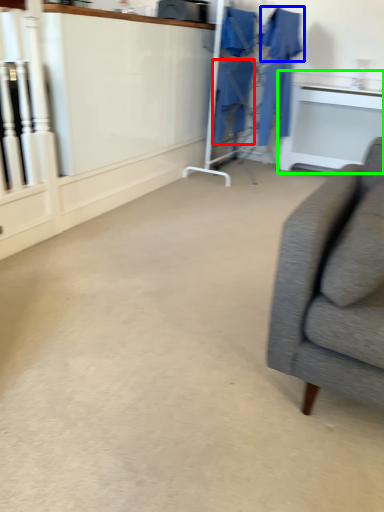
Question: Which is farther away from robe (highlighted by a red box)? robe (highlighted by a blue box) or table (highlighted by a green box)?

Choices:
 (A) robe
 (B) table

Answer: (B)